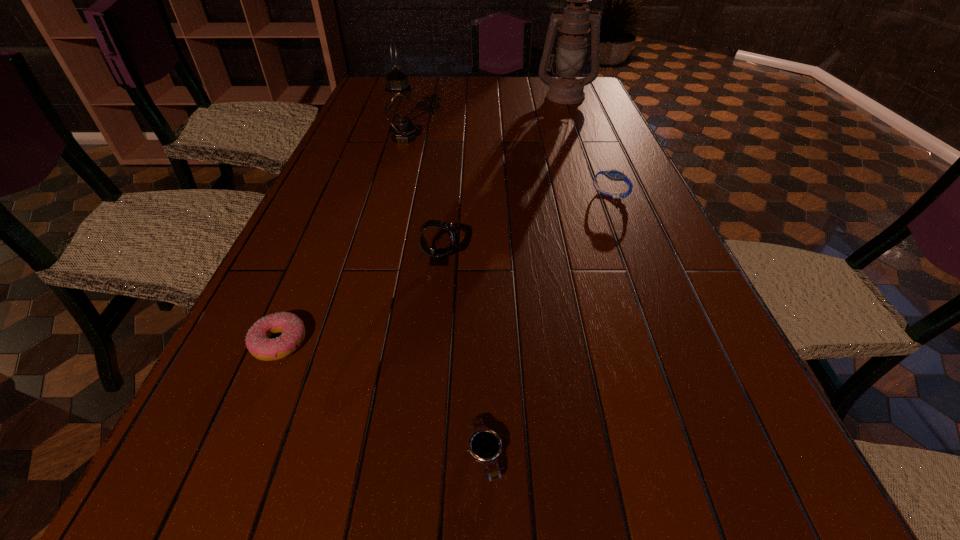
At what (x,y) coordinates should I click in order to perform the action: click on vacant position in the image that satisfies the following two spatial constraints: 1. on the face of the second watch from right to left; 2. on the left side of the third object from left to right. Please return your answer as a coordinate pair (x, y). This screenshot has height=540, width=960. Looking at the image, I should click on (420, 455).

Find the location of `vacant area in the image that satisfies the following two spatial constraints: 1. on the face of the fourth object from left to right; 2. on the left side of the second nearest watch`. vacant area in the image that satisfies the following two spatial constraints: 1. on the face of the fourth object from left to right; 2. on the left side of the second nearest watch is located at coordinates (420, 455).

The image size is (960, 540). In order to click on free spot that satisfies the following two spatial constraints: 1. on the front side of the shortest watch; 2. on the left side of the fifth tallest object in this screenshot , I will do `click(232, 455)`.

Where is `vacant space that satisfies the following two spatial constraints: 1. on the front side of the left oil lamp; 2. on the right side of the fourth tallest object`? This screenshot has height=540, width=960. vacant space that satisfies the following two spatial constraints: 1. on the front side of the left oil lamp; 2. on the right side of the fourth tallest object is located at coordinates (388, 195).